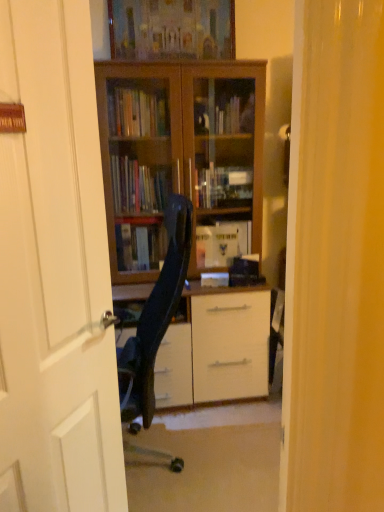
Question: From the image's perspective, is white wooden door at center beneath wooden bookcase at center?

Choices:
 (A) no
 (B) yes

Answer: (B)

Question: Considering the relative sizes of white wooden door at center and wooden bookcase at center in the image provided, is white wooden door at center thinner than wooden bookcase at center?

Choices:
 (A) no
 (B) yes

Answer: (B)

Question: Considering the relative sizes of white wooden door at center and wooden bookcase at center in the image provided, is white wooden door at center taller than wooden bookcase at center?

Choices:
 (A) yes
 (B) no

Answer: (B)

Question: Does white wooden door at center touch wooden bookcase at center?

Choices:
 (A) yes
 (B) no

Answer: (B)

Question: Does white wooden door at center lie behind wooden bookcase at center?

Choices:
 (A) yes
 (B) no

Answer: (B)

Question: Is white wooden door at center not near wooden bookcase at center?

Choices:
 (A) no
 (B) yes

Answer: (B)

Question: From a real-world perspective, is black leather chair at center below wooden picture frame at upper center?

Choices:
 (A) no
 (B) yes

Answer: (B)

Question: From the image's perspective, would you say black leather chair at center is shown under wooden picture frame at upper center?

Choices:
 (A) no
 (B) yes

Answer: (B)

Question: Considering the relative positions of black leather chair at center and wooden picture frame at upper center in the image provided, is black leather chair at center to the left of wooden picture frame at upper center from the viewer's perspective?

Choices:
 (A) no
 (B) yes

Answer: (B)

Question: From the image's perspective, would you say black leather chair at center is positioned over wooden picture frame at upper center?

Choices:
 (A) yes
 (B) no

Answer: (B)

Question: Is black leather chair at center to the right of wooden picture frame at upper center from the viewer's perspective?

Choices:
 (A) yes
 (B) no

Answer: (B)

Question: From a real-world perspective, is black leather chair at center over wooden picture frame at upper center?

Choices:
 (A) yes
 (B) no

Answer: (B)

Question: Is wooden picture frame at upper center thinner than white wooden door at center?

Choices:
 (A) no
 (B) yes

Answer: (B)